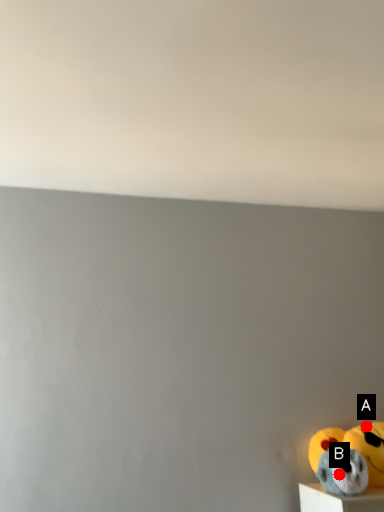
Question: Two points are circled on the image, labeled by A and B beside each circle. Which point is further to the camera?

Choices:
 (A) A is further
 (B) B is further

Answer: (A)